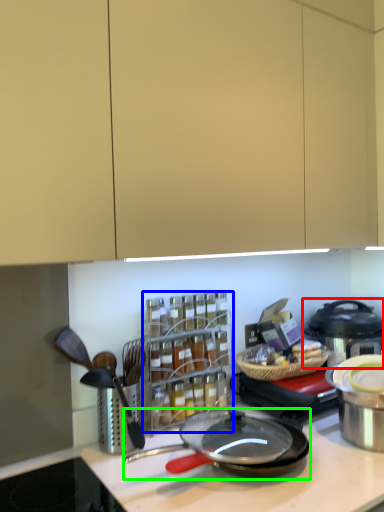
Question: Which object is positioned farthest from kitchen appliance (highlighted by a red box)? Select from spice rack (highlighted by a blue box) and frying pan (highlighted by a green box).

Choices:
 (A) spice rack
 (B) frying pan

Answer: (B)